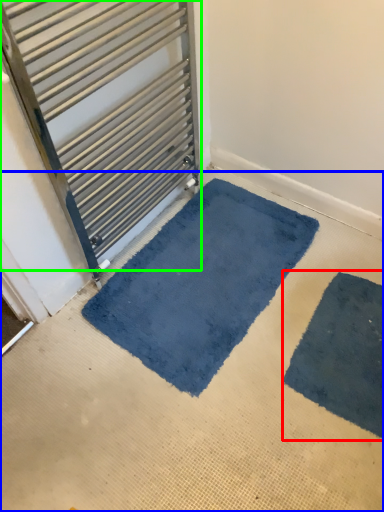
Question: Which object is the closest to the bath mat (highlighted by a red box)? Choose among these: concrete (highlighted by a blue box) or door (highlighted by a green box).

Choices:
 (A) concrete
 (B) door

Answer: (A)